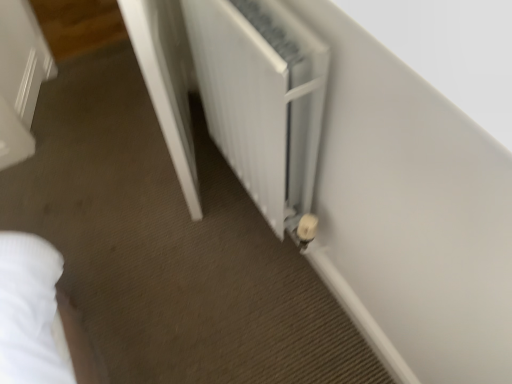
Question: Is white glossy door at center aimed at white matte radiator at center?

Choices:
 (A) yes
 (B) no

Answer: (B)

Question: Does white glossy door at center have a smaller size compared to white matte radiator at center?

Choices:
 (A) yes
 (B) no

Answer: (B)

Question: Can you confirm if white glossy door at center is positioned to the left of white matte radiator at center?

Choices:
 (A) no
 (B) yes

Answer: (B)

Question: Does white glossy door at center have a greater height compared to white matte radiator at center?

Choices:
 (A) no
 (B) yes

Answer: (B)

Question: Considering the relative sizes of white glossy door at center and white matte radiator at center in the image provided, is white glossy door at center bigger than white matte radiator at center?

Choices:
 (A) no
 (B) yes

Answer: (B)

Question: Can you confirm if white glossy door at center is wider than white matte radiator at center?

Choices:
 (A) yes
 (B) no

Answer: (B)

Question: Is white matte radiator at center far from white glossy door at center?

Choices:
 (A) no
 (B) yes

Answer: (A)

Question: Does white matte radiator at center have a smaller size compared to white glossy door at center?

Choices:
 (A) yes
 (B) no

Answer: (A)

Question: Does white matte radiator at center appear on the right side of white glossy door at center?

Choices:
 (A) no
 (B) yes

Answer: (B)

Question: Does white matte radiator at center have a greater width compared to white glossy door at center?

Choices:
 (A) no
 (B) yes

Answer: (B)

Question: Is white matte radiator at center next to white glossy door at center?

Choices:
 (A) yes
 (B) no

Answer: (B)

Question: Is white matte radiator at center facing away from white glossy door at center?

Choices:
 (A) yes
 (B) no

Answer: (B)

Question: Considering the positions of white matte radiator at center and white glossy door at center in the image, is white matte radiator at center wider or thinner than white glossy door at center?

Choices:
 (A) thin
 (B) wide

Answer: (B)